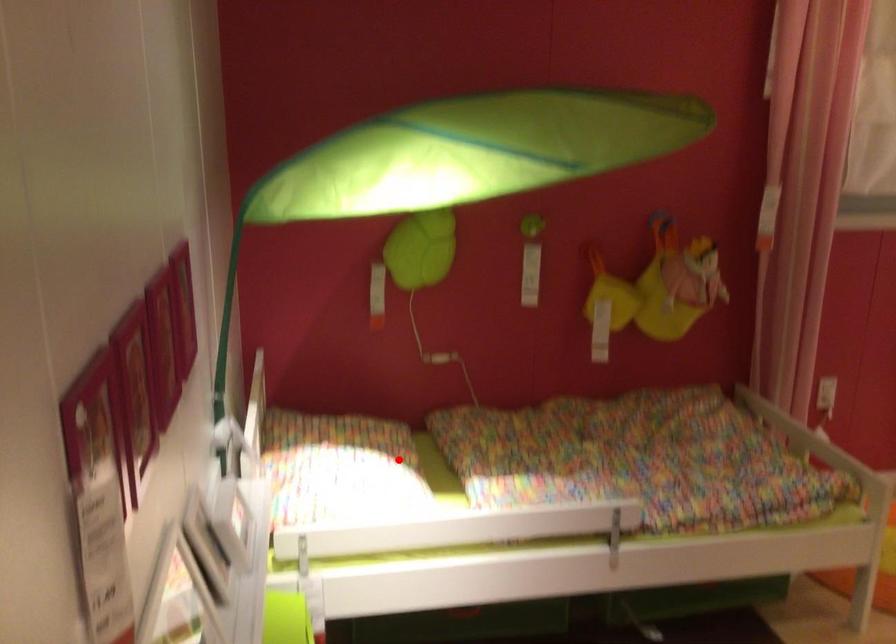
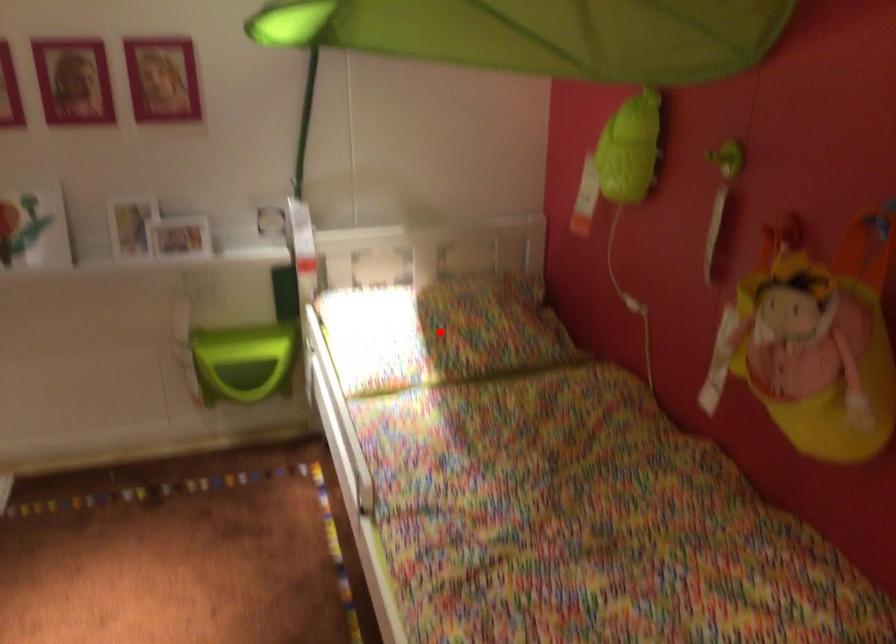
From the picture: I am providing you with two images of the same scene from different viewpoints. A red point is marked on the first image and another point is marked on the second image. Is the red point in image1 aligned with the point shown in image2?

Yes